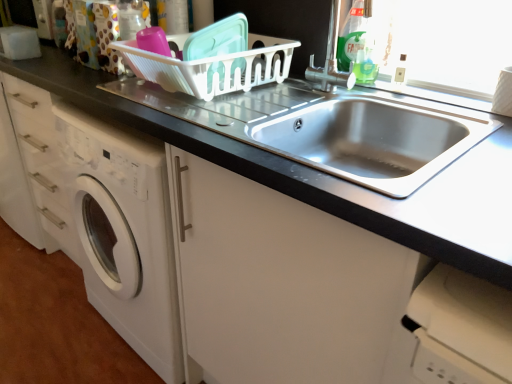
Question: Looking at their shapes, would you say stainless steel sink at center is wider or thinner than white plastic basket at upper center?

Choices:
 (A) wide
 (B) thin

Answer: (A)

Question: From the image's perspective, is stainless steel sink at center above or below white plastic basket at upper center?

Choices:
 (A) above
 (B) below

Answer: (B)

Question: Which of these objects is positioned closest to the white plastic basket at upper center?

Choices:
 (A) stainless steel sink at center
 (B) green plastic bottle at upper right
 (C) stainless steel sink at center
 (D) satin nickel faucet at upper right

Answer: (D)

Question: Based on their relative distances, which object is farther from the green plastic bottle at upper right?

Choices:
 (A) stainless steel sink at center
 (B) stainless steel sink at center
 (C) white plastic basket at upper center
 (D) satin nickel faucet at upper right

Answer: (A)